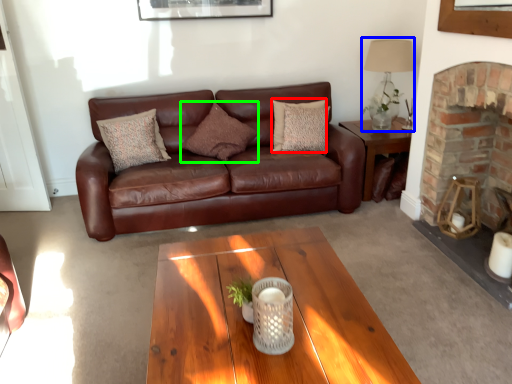
Question: Estimate the real-world distances between objects in this image. Which object is closer to pillow (highlighted by a red box), lamp (highlighted by a blue box) or pillow (highlighted by a green box)?

Choices:
 (A) lamp
 (B) pillow

Answer: (B)